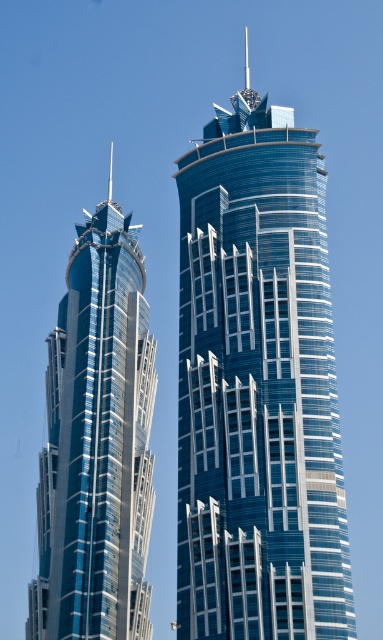
Looking at this image, you are standing at the origin point of the coordinate system. Looking at the image, where is the transparent glass tower at center located in terms of coordinates?

The transparent glass tower at center is located at coordinates point (258,387).

You are an architect evaluating the two buildings in the image. Which of the two buildings, the transparent glass tower at center or the glossy glass skyscraper at left, is shorter?

The transparent glass tower at center is shorter than the glossy glass skyscraper at left according to the description.